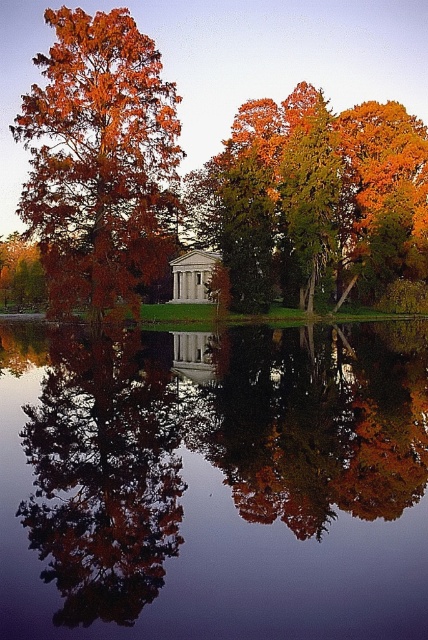
You are an artist trying to paint the scene. You want to ensure the smooth reflective water at center and the orange foliage tree at upper left are proportionally accurate. Which object should you paint first if you want to start with the larger one?

The orange foliage tree at upper left is larger than the smooth reflective water at center, so you should paint the orange foliage tree at upper left first.